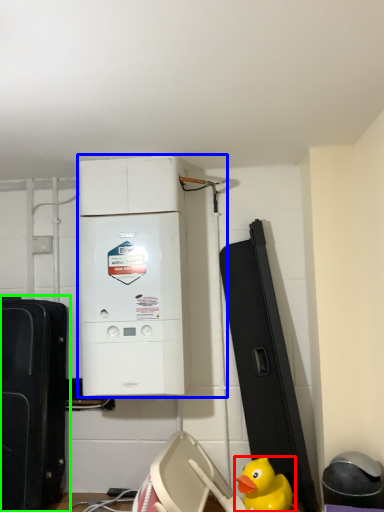
Question: Based on their relative distances, which object is farther from duck (highlighted by a red box)? Choose from home appliance (highlighted by a blue box) and toy (highlighted by a green box).

Choices:
 (A) home appliance
 (B) toy

Answer: (B)